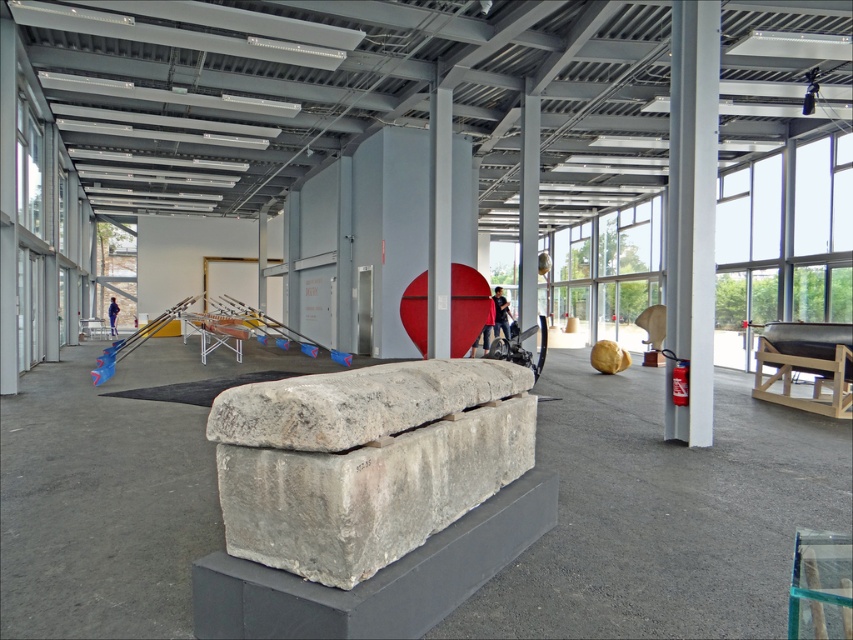
Between point (498, 323) and point (114, 326), which one is positioned in front?

Point (498, 323)

What do you see at coordinates (500, 314) in the screenshot? The width and height of the screenshot is (853, 640). I see `black fabric person at center` at bounding box center [500, 314].

Is point (496, 310) positioned behind point (108, 314)?

No, (496, 310) is in front of (108, 314).

What are the coordinates of `black fabric person at center` in the screenshot? It's located at (500, 314).